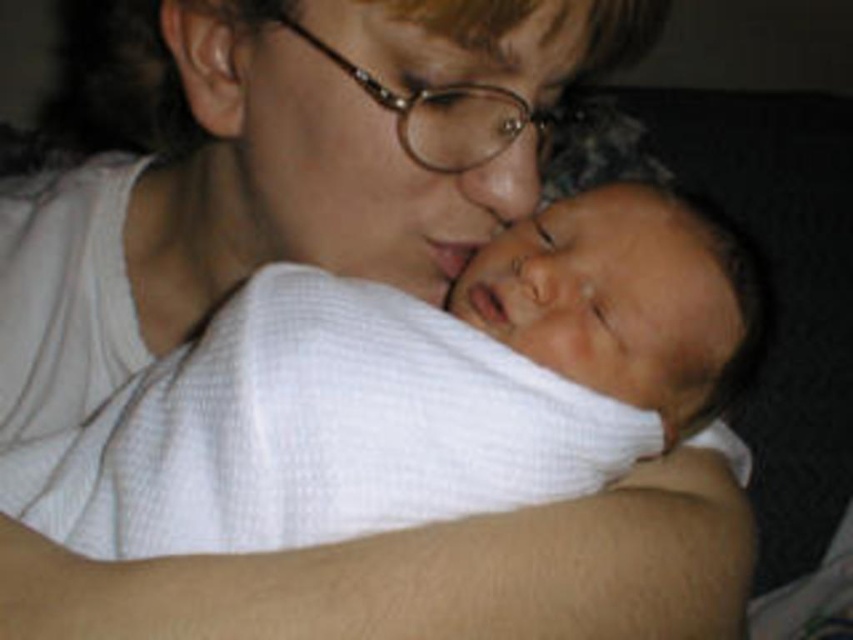
You are taking a photo of the scene described. You notice two points marked in the image. The first point is at coordinates point (537,241), and the second point is at point (561,518). Which point is closer to the camera?

Point (561,518) is closer to the camera because the description states that point (537,241) is further away than point (561,518).

Looking at this image, you are an observer looking at the scene. The adult is wearing a white cotton shirt at center and has a soft beige arm at center. Which part of the adult is higher in the image?

The white cotton shirt at center is taller than the soft beige arm at center, so the white cotton shirt at center is higher in the image.

You are a photographer adjusting the lighting for a portrait. You notice the white textured cloth at center and the soft beige arm at center in the scene. Which object should you adjust the lighting on first if you want to ensure the one closer to the camera is properly illuminated?

The white textured cloth at center is above the soft beige arm at center, meaning it is closer to the camera. Therefore, you should adjust the lighting on the white textured cloth at center first to ensure proper illumination.